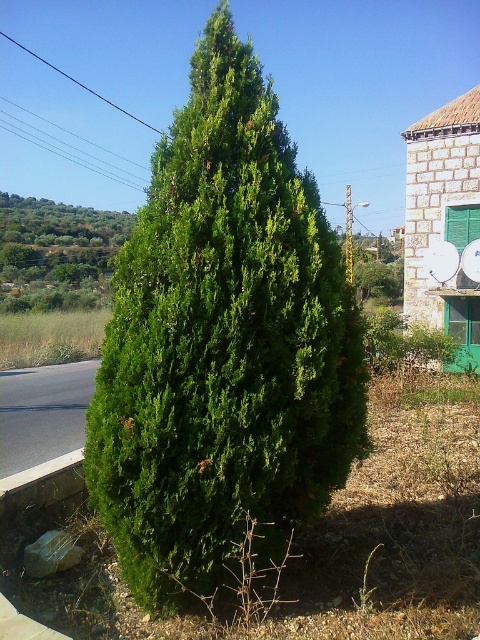
You are a landscape architect designing a garden and want to place a statue between the green leafy shrub at center and the green leafy tree at upper left. Which side of the statue should face the shorter plant?

The green leafy shrub at center is not as tall as the green leafy tree at upper left, so the shorter plant is the green leafy shrub at center. Therefore, the side of the statue facing the green leafy shrub at center should face the shorter plant.

You are a pedestrian standing at the gray concrete curb at lower left and want to walk towards the green leafy tree at upper left. Which direction should you move to reach it?

The green leafy tree at upper left is positioned on the left side of the gray concrete curb at lower left, so you should move to your left to reach it.